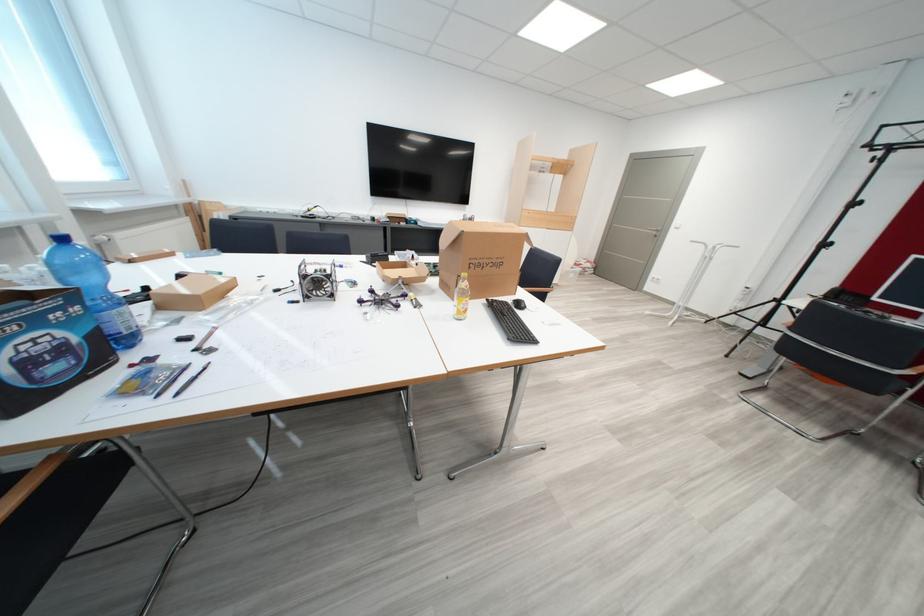
Describe the element at coordinates (541, 288) in the screenshot. I see `the black chair sitting surface` at that location.